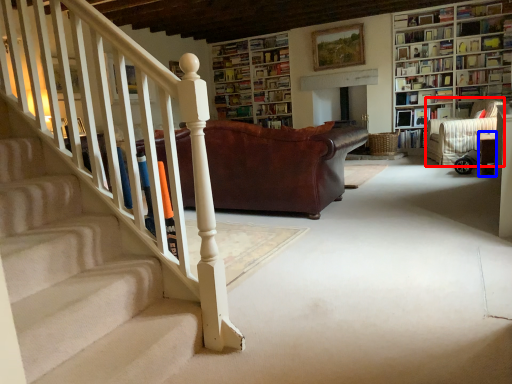
Question: Which of the following is the farthest to the observer, armchair (highlighted by a red box) or furniture (highlighted by a blue box)?

Choices:
 (A) armchair
 (B) furniture

Answer: (A)